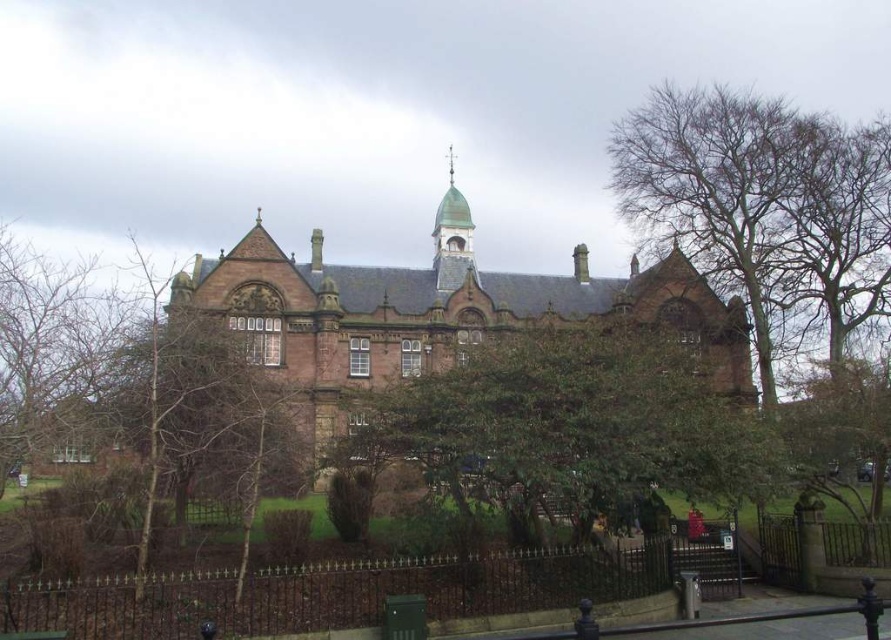
You are standing in front of a historic Victorian building and notice two prominent features at the center of the image. One is the brown stone church at center, and the other is the green leafy tree at center. Which of these two is closer to you?

The brown stone church at center is closer to you because it is positioned further to the viewer than the green leafy tree at center.

You are a landscape architect planning to install a new pathway between the brown stone church at center and the green leafy tree at center. The pathway requires a minimum of 12 meters of space. Based on the image, will the available space between them accommodate the pathway?

The distance between the brown stone church at center and the green leafy tree at center is 13.34 meters, which exceeds the required 12 meters. Therefore, the pathway can be installed between them.

Looking at this image, you are a photographer planning to capture the brown stone church at center and the green leafy tree at center in a single frame. Based on their sizes, which object should you focus on to ensure both are clearly visible in the photo?

The brown stone church at center is larger in size than the green leafy tree at center, so focusing on the brown stone church at center will ensure both are clearly visible in the photo.